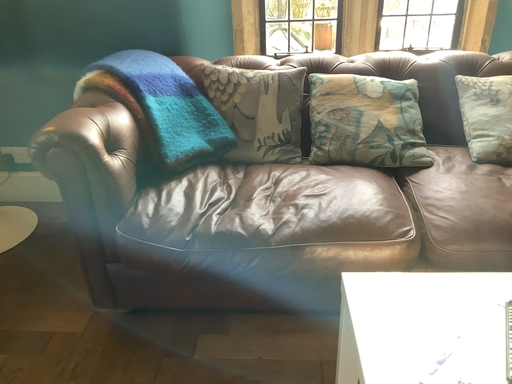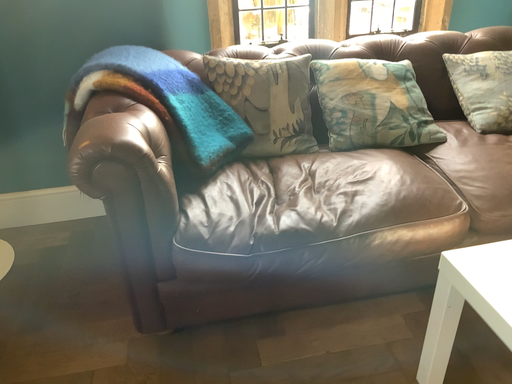
Question: Which way did the camera rotate in the video?

Choices:
 (A) rotated right
 (B) rotated left

Answer: (A)